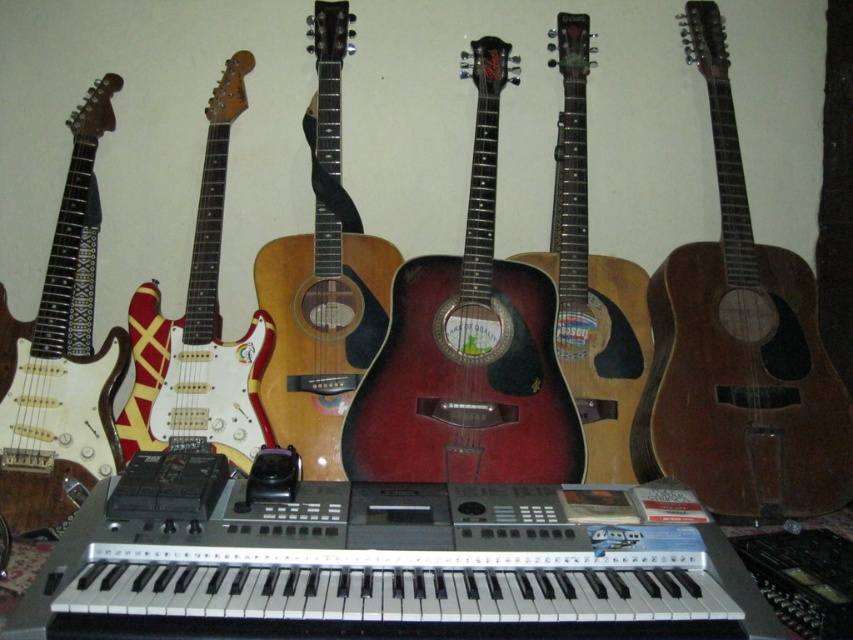
You are a music teacher setting up a classroom. You have a storage rack that can only hold instruments up to the size of the white glossy electric guitar at left. Can the brown wooden guitar at right fit into this rack?

The brown wooden guitar at right is larger in size than the white glossy electric guitar at left. Therefore, it cannot fit into the storage rack designed for the smaller size.